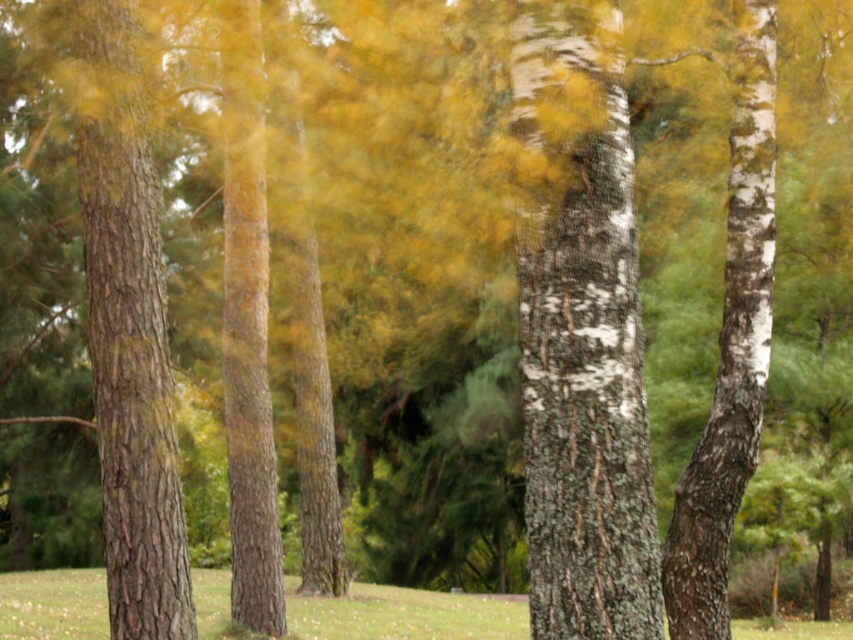
Question: Which of the following is the closest to the observer?

Choices:
 (A) (125, 332)
 (B) (642, 568)
 (C) (750, 445)

Answer: (B)

Question: Does white bark tree trunk at center appear under brown rough bark tree trunk at left?

Choices:
 (A) no
 (B) yes

Answer: (B)

Question: Which object is the closest to the white bark tree trunk at center?

Choices:
 (A) white bark tree trunk at right
 (B) brown rough bark tree trunk at left

Answer: (B)

Question: Does white bark tree trunk at center have a greater width compared to brown rough bark tree trunk at left?

Choices:
 (A) no
 (B) yes

Answer: (A)

Question: Which point is closer to the camera?

Choices:
 (A) (x=90, y=134)
 (B) (x=726, y=461)
 (C) (x=584, y=596)

Answer: (C)

Question: Can you confirm if brown rough bark tree trunk at left is smaller than white bark tree trunk at right?

Choices:
 (A) yes
 (B) no

Answer: (B)